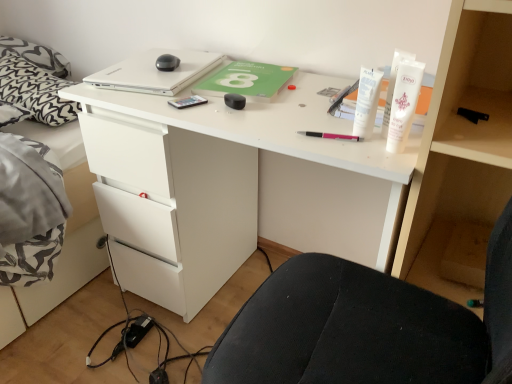
Locate an element on the screen. The width and height of the screenshot is (512, 384). vacant area on the back side of pink plastic pen at center, acting as the 3th stationery starting from the back is located at coordinates (307, 110).